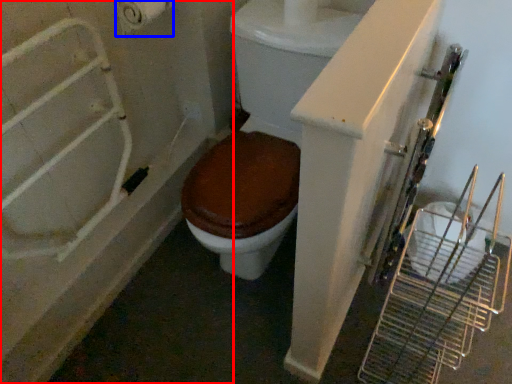
Question: Among these objects, which one is farthest to the camera, bath (highlighted by a red box) or toilet paper (highlighted by a blue box)?

Choices:
 (A) bath
 (B) toilet paper

Answer: (B)